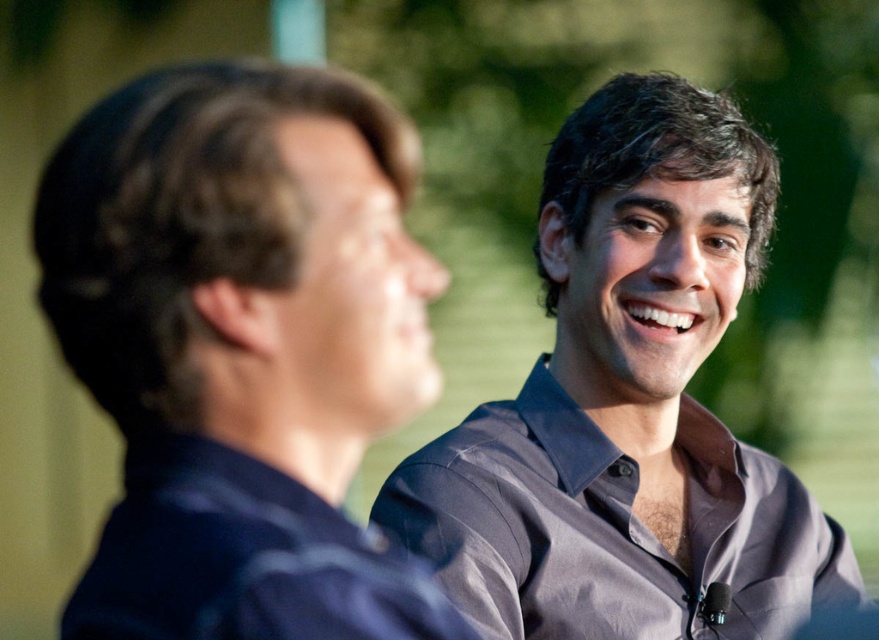
Question: Can you confirm if dark blue shirt at left is thinner than gray satin dress shirt at center?

Choices:
 (A) yes
 (B) no

Answer: (A)

Question: Which of these objects is positioned closest to the gray matte dress shirt at right?

Choices:
 (A) dark blue shirt at left
 (B) gray satin dress shirt at center

Answer: (B)

Question: Among these points, which one is nearest to the camera?

Choices:
 (A) pyautogui.click(x=299, y=474)
 (B) pyautogui.click(x=596, y=604)
 (C) pyautogui.click(x=649, y=182)

Answer: (A)

Question: Does dark blue shirt at left appear over gray satin dress shirt at center?

Choices:
 (A) yes
 (B) no

Answer: (A)

Question: Is dark blue shirt at left to the left of gray matte dress shirt at right from the viewer's perspective?

Choices:
 (A) no
 (B) yes

Answer: (B)

Question: Which point is closer to the camera?

Choices:
 (A) dark blue shirt at left
 (B) gray matte dress shirt at right
 (C) gray satin dress shirt at center

Answer: (A)